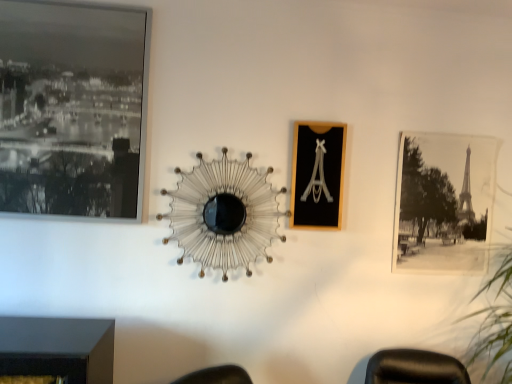
Question: From the image's perspective, is green leafy plant at right over black paper photo at right, which ranks as the 1th picture frame in right-to-left order?

Choices:
 (A) yes
 (B) no

Answer: (B)

Question: Could you tell me if green leafy plant at right is turned towards black paper photo at right, which appears as the 3th picture frame when viewed from the left?

Choices:
 (A) no
 (B) yes

Answer: (A)

Question: Is green leafy plant at right thinner than black paper photo at right, marked as the third picture frame in a front-to-back arrangement?

Choices:
 (A) yes
 (B) no

Answer: (B)

Question: Would you say green leafy plant at right is a long distance from black paper photo at right, which appears as the 3th picture frame when viewed from the left?

Choices:
 (A) no
 (B) yes

Answer: (A)

Question: Is green leafy plant at right located outside black paper photo at right, the first picture frame from the back?

Choices:
 (A) no
 (B) yes

Answer: (B)

Question: Considering the relative positions of green leafy plant at right and black paper photo at right, which appears as the 3th picture frame when viewed from the left, in the image provided, is green leafy plant at right to the left of black paper photo at right, which appears as the 3th picture frame when viewed from the left, from the viewer's perspective?

Choices:
 (A) yes
 (B) no

Answer: (B)

Question: From a real-world perspective, is black paper photo at right, marked as the third picture frame in a front-to-back arrangement, under black glass picture frame at upper left, marked as the first picture frame in a left-to-right arrangement?

Choices:
 (A) no
 (B) yes

Answer: (B)

Question: From a real-world perspective, does black paper photo at right, which appears as the 3th picture frame when viewed from the left, stand above black glass picture frame at upper left, which ranks as the 1th picture frame in front-to-back order?

Choices:
 (A) yes
 (B) no

Answer: (B)

Question: Can you confirm if black paper photo at right, which appears as the 3th picture frame when viewed from the left, is smaller than black glass picture frame at upper left, the 3th picture frame positioned from the right?

Choices:
 (A) yes
 (B) no

Answer: (A)

Question: Does black paper photo at right, the first picture frame from the back, appear on the left side of black glass picture frame at upper left, positioned as the 3th picture frame in back-to-front order?

Choices:
 (A) no
 (B) yes

Answer: (A)

Question: Is black paper photo at right, marked as the third picture frame in a front-to-back arrangement, aimed at black glass picture frame at upper left, the 3th picture frame positioned from the right?

Choices:
 (A) yes
 (B) no

Answer: (B)

Question: Is black paper photo at right, which appears as the 3th picture frame when viewed from the left, completely or partially outside of black glass picture frame at upper left, which ranks as the 1th picture frame in front-to-back order?

Choices:
 (A) yes
 (B) no

Answer: (A)

Question: Is metallic wire at center positioned beyond the bounds of black wood picture frame at center, the 2th picture frame from the front?

Choices:
 (A) yes
 (B) no

Answer: (A)